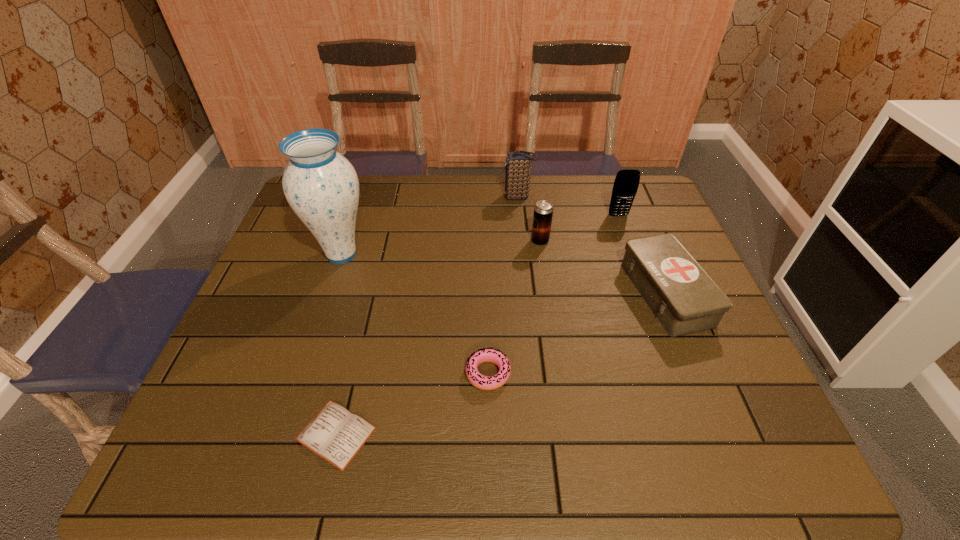
Where is `vase`? The image size is (960, 540). vase is located at coordinates (321, 186).

This screenshot has width=960, height=540. Identify the location of clutch bag. (518, 164).

Where is `cellular telephone`? The width and height of the screenshot is (960, 540). cellular telephone is located at coordinates (626, 183).

In order to click on beer can in this screenshot , I will do `click(543, 211)`.

This screenshot has height=540, width=960. Find the location of `the third shortest object`. the third shortest object is located at coordinates (683, 297).

The image size is (960, 540). I want to click on the third object from left to right, so click(x=482, y=382).

I want to click on the second shortest object, so click(482, 382).

Where is `the shortest object`? the shortest object is located at coordinates (335, 434).

Where is `diary`? The width and height of the screenshot is (960, 540). diary is located at coordinates (335, 434).

At what (x,y) coordinates should I click in order to perform the action: click on vacant region located 0.150m on the right of the tallest object. Please return your answer as a coordinate pair (x, y). The width and height of the screenshot is (960, 540). Looking at the image, I should click on (425, 254).